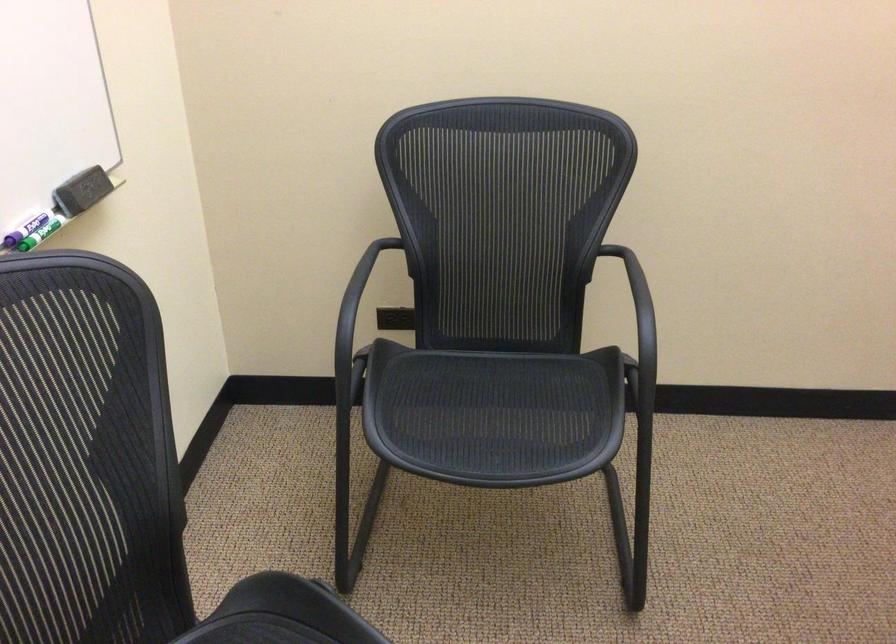
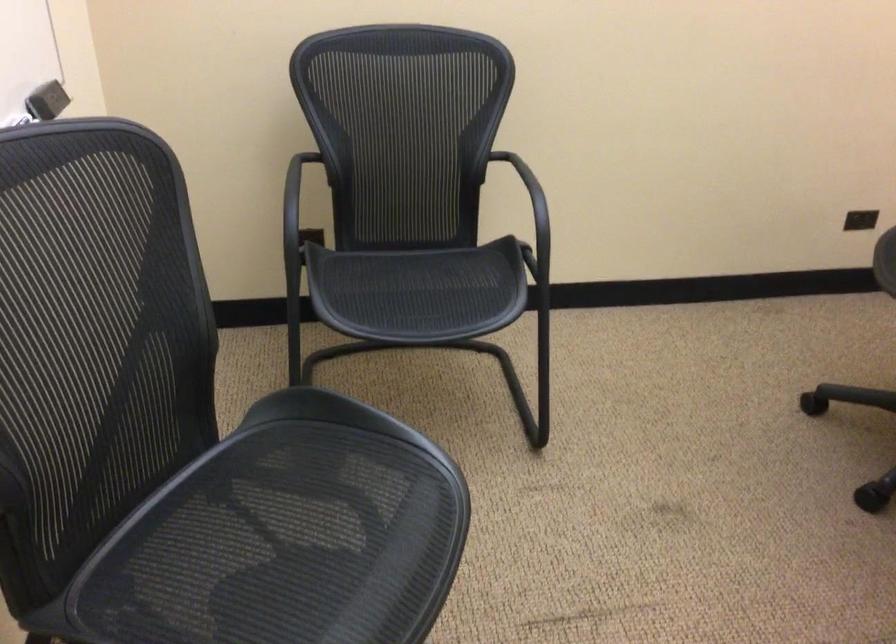
Find the pixel in the second image that matches pixel 478 406 in the first image.

(409, 287)